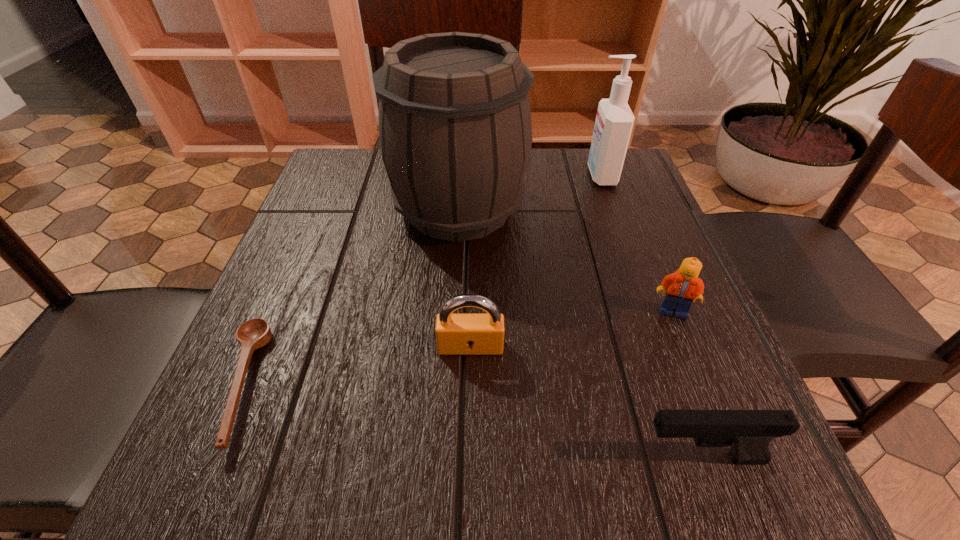
The height and width of the screenshot is (540, 960). I want to click on the tallest object, so click(455, 132).

The height and width of the screenshot is (540, 960). I want to click on the fifth shortest object, so click(x=614, y=121).

Locate an element on the screen. This screenshot has width=960, height=540. Lego is located at coordinates (684, 286).

The height and width of the screenshot is (540, 960). Identify the location of padlock. (456, 333).

Image resolution: width=960 pixels, height=540 pixels. I want to click on pistol, so click(749, 433).

Where is `the leftmost object`? This screenshot has height=540, width=960. the leftmost object is located at coordinates (255, 333).

Where is `the shortest object`? This screenshot has height=540, width=960. the shortest object is located at coordinates (255, 333).

You are a GUI agent. You are given a task and a screenshot of the screen. Output one action in this format:
    pyautogui.click(x=<x>, y=<y>)
    Task: Click on the vacant space located 0.100m on the left of the wine bucket
    The width and height of the screenshot is (960, 540).
    Given the screenshot: What is the action you would take?
    pyautogui.click(x=344, y=208)

You are a GUI agent. You are given a task and a screenshot of the screen. Output one action in this format:
    pyautogui.click(x=<x>, y=<y>)
    Task: Click on the vacant area located 0.140m on the front label of the fifth shortest object
    
    Given the screenshot: What is the action you would take?
    pyautogui.click(x=527, y=176)

Where is `free space located on the front label of the fifth shortest object`? free space located on the front label of the fifth shortest object is located at coordinates (468, 176).